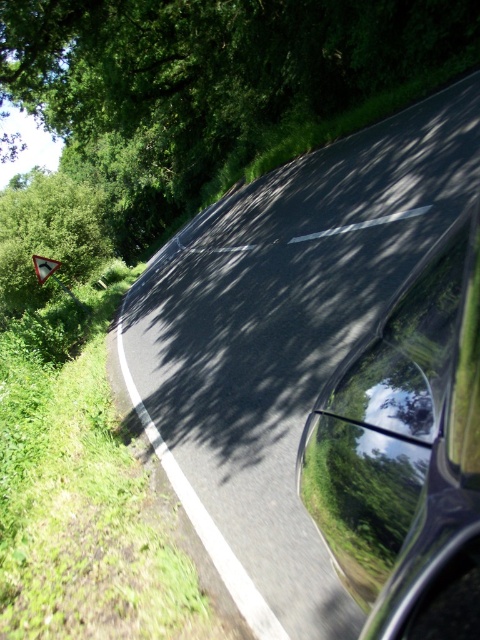
You are driving a car and see the glossy black car window at center and the metallic triangular sign at center ahead. Which object is taller?

The glossy black car window at center is much taller than the metallic triangular sign at center.

You are driving a car and see the glossy black car window at center and the white plastic triangle at left ahead on the road. How far apart are these two objects from each other?

The glossy black car window at center is 15.10 meters from the white plastic triangle at left, so the distance between them is 15.10 meters.

You are standing on the side of the road and want to check if your 36 inch long ladder can be safely placed against the glossy black car window at center without touching it. Can you do that?

The distance between you and the glossy black car window at center is 35.85 inches. Since your ladder is 36 inches long, placing it would require at least 36 inches of space. Therefore, the ladder would be too long and might touch the window or be unstable.